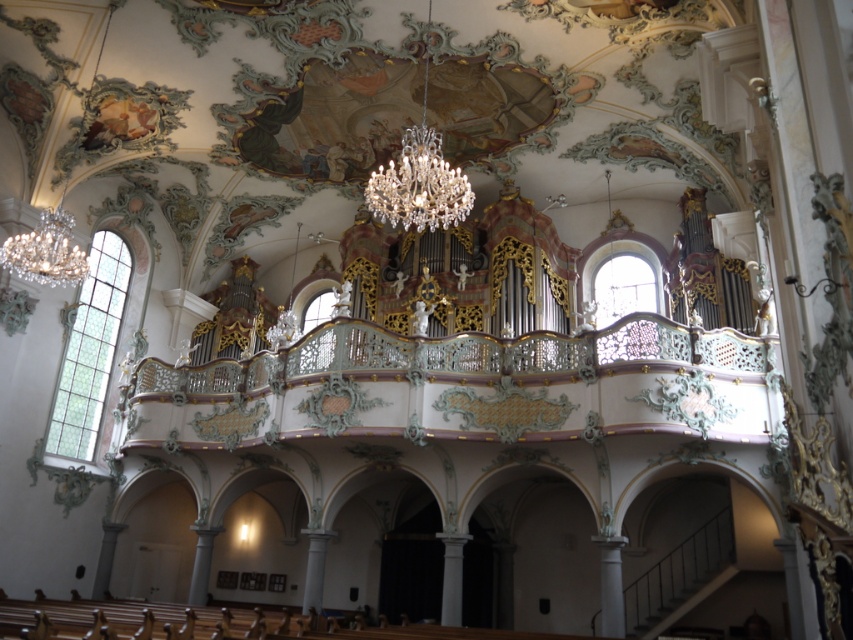
Question: Which of the following is the farthest from the observer?

Choices:
 (A) (746, 387)
 (B) (13, 253)

Answer: (B)

Question: Does pastel green ornate balcony at center have a larger size compared to crystal glass chandelier at upper center?

Choices:
 (A) yes
 (B) no

Answer: (A)

Question: Can you confirm if pastel green ornate balcony at center is positioned below crystal glass chandelier at upper center?

Choices:
 (A) no
 (B) yes

Answer: (B)

Question: Observing the image, what is the correct spatial positioning of pastel green ornate balcony at center in reference to crystal glass chandelier at upper center?

Choices:
 (A) left
 (B) right

Answer: (B)

Question: Which point is farther from the camera taking this photo?

Choices:
 (A) (338, 317)
 (B) (18, 252)

Answer: (A)